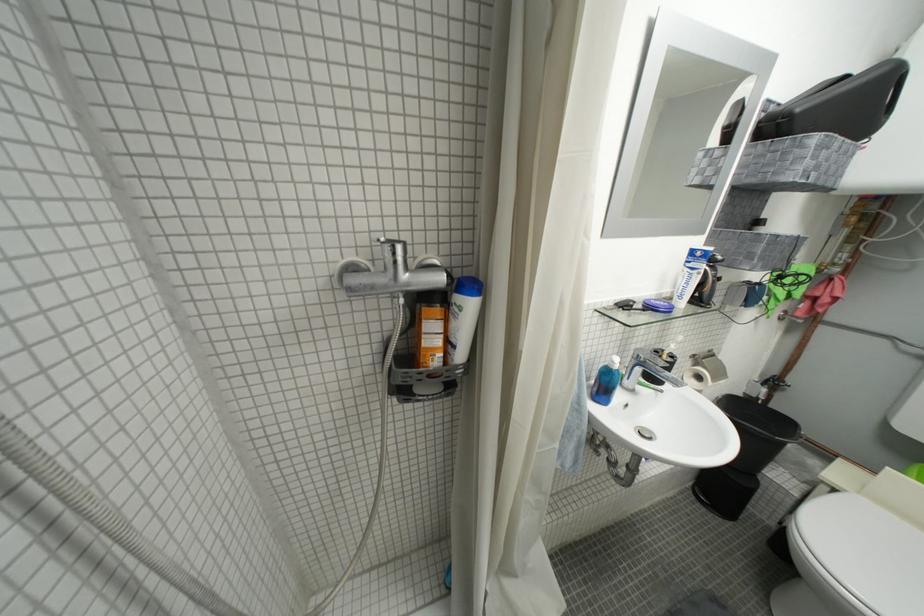
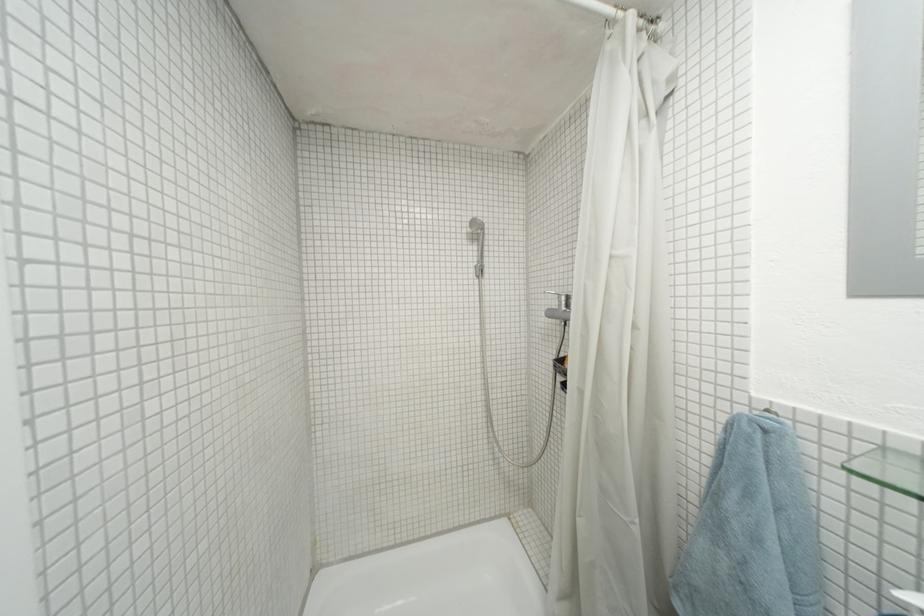
Question: The camera is either moving clockwise (left) or counter-clockwise (right) around the object. The first image is from the beginning of the video and the second image is from the end. Is the camera moving left or right when shooting the video?

Choices:
 (A) Left
 (B) Right

Answer: (B)